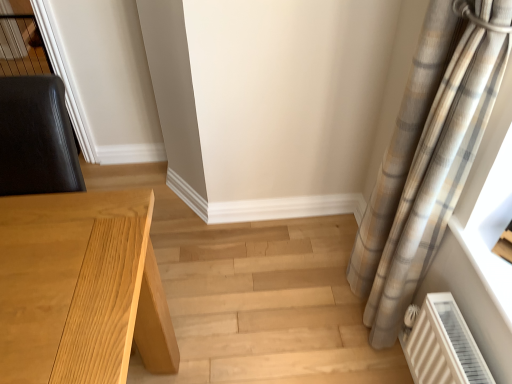
Question: Does plaid fabric curtain at right turn towards light wood table at left?

Choices:
 (A) yes
 (B) no

Answer: (A)

Question: Can you confirm if plaid fabric curtain at right is smaller than light wood table at left?

Choices:
 (A) no
 (B) yes

Answer: (B)

Question: Is plaid fabric curtain at right wider than light wood table at left?

Choices:
 (A) yes
 (B) no

Answer: (B)

Question: Is plaid fabric curtain at right outside of light wood table at left?

Choices:
 (A) yes
 (B) no

Answer: (A)

Question: Is plaid fabric curtain at right oriented away from light wood table at left?

Choices:
 (A) yes
 (B) no

Answer: (B)

Question: From a real-world perspective, is plaid fabric curtain at right on light wood table at left?

Choices:
 (A) no
 (B) yes

Answer: (B)

Question: Is light wood table at left oriented towards plaid fabric curtain at right?

Choices:
 (A) no
 (B) yes

Answer: (A)

Question: Is light wood table at left not within plaid fabric curtain at right?

Choices:
 (A) yes
 (B) no

Answer: (A)

Question: Is light wood table at left with plaid fabric curtain at right?

Choices:
 (A) yes
 (B) no

Answer: (B)

Question: Can you confirm if light wood table at left is smaller than plaid fabric curtain at right?

Choices:
 (A) yes
 (B) no

Answer: (B)

Question: Can you confirm if light wood table at left is bigger than plaid fabric curtain at right?

Choices:
 (A) no
 (B) yes

Answer: (B)

Question: From a real-world perspective, does light wood table at left sit lower than plaid fabric curtain at right?

Choices:
 (A) no
 (B) yes

Answer: (B)

Question: From the image's perspective, is light wood table at left positioned above or below plaid fabric curtain at right?

Choices:
 (A) above
 (B) below

Answer: (B)